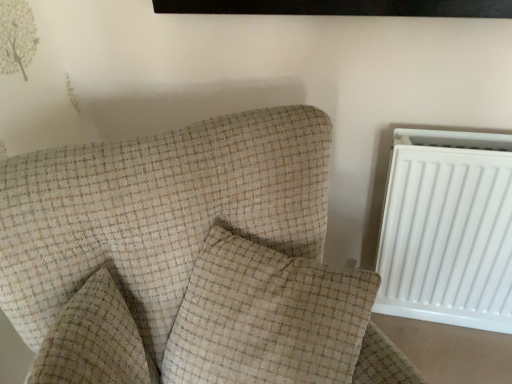
Question: From the image's perspective, would you say white plastic radiator at right is shown under beige textured pillow at center, which appears as the 1th pillow when viewed from the right?

Choices:
 (A) yes
 (B) no

Answer: (B)

Question: Considering the relative positions of white plastic radiator at right and beige textured pillow at center, which appears as the 1th pillow when viewed from the right, in the image provided, is white plastic radiator at right to the right of beige textured pillow at center, which appears as the 1th pillow when viewed from the right, from the viewer's perspective?

Choices:
 (A) yes
 (B) no

Answer: (A)

Question: From a real-world perspective, is white plastic radiator at right physically below beige textured pillow at center, which appears as the 1th pillow when viewed from the right?

Choices:
 (A) no
 (B) yes

Answer: (B)

Question: Does white plastic radiator at right have a lesser height compared to beige textured pillow at center, which appears as the 2th pillow when viewed from the left?

Choices:
 (A) yes
 (B) no

Answer: (B)

Question: Is white plastic radiator at right taller than beige textured pillow at center, which appears as the 1th pillow when viewed from the right?

Choices:
 (A) no
 (B) yes

Answer: (B)

Question: In terms of height, does white plastic radiator at right look taller or shorter compared to beige checkered armchair at center-left?

Choices:
 (A) short
 (B) tall

Answer: (A)

Question: Based on their sizes in the image, would you say white plastic radiator at right is bigger or smaller than beige checkered armchair at center-left?

Choices:
 (A) small
 (B) big

Answer: (A)

Question: From a real-world perspective, relative to beige checkered armchair at center-left, is white plastic radiator at right vertically above or below?

Choices:
 (A) below
 (B) above

Answer: (A)

Question: In the image, is white plastic radiator at right on the left side or the right side of beige checkered armchair at center-left?

Choices:
 (A) right
 (B) left

Answer: (A)

Question: Is beige checkered pillow at center, which is counted as the first pillow, starting from the left, taller or shorter than white plastic radiator at right?

Choices:
 (A) tall
 (B) short

Answer: (B)

Question: From the image's perspective, is beige checkered pillow at center, which is counted as the first pillow, starting from the left, above or below white plastic radiator at right?

Choices:
 (A) above
 (B) below

Answer: (B)

Question: Looking at their shapes, would you say beige checkered pillow at center, acting as the 2th pillow starting from the right, is wider or thinner than white plastic radiator at right?

Choices:
 (A) thin
 (B) wide

Answer: (B)

Question: Considering the positions of beige checkered pillow at center, acting as the 2th pillow starting from the right, and white plastic radiator at right in the image, is beige checkered pillow at center, acting as the 2th pillow starting from the right, bigger or smaller than white plastic radiator at right?

Choices:
 (A) big
 (B) small

Answer: (B)

Question: Is beige textured pillow at center, which appears as the 2th pillow when viewed from the left, wider or thinner than beige checkered pillow at center, which is counted as the first pillow, starting from the left?

Choices:
 (A) wide
 (B) thin

Answer: (A)

Question: From the image's perspective, is beige textured pillow at center, which appears as the 2th pillow when viewed from the left, above or below beige checkered pillow at center, which is counted as the first pillow, starting from the left?

Choices:
 (A) above
 (B) below

Answer: (A)